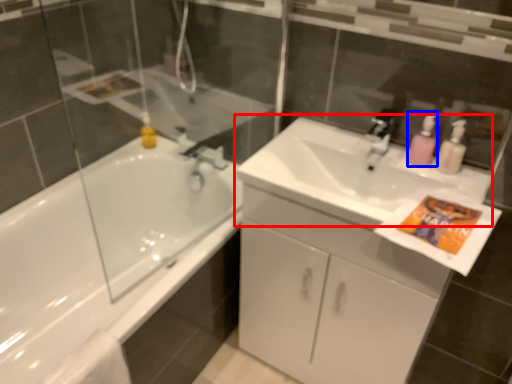
Question: Which point is closer to the camera, sink (highlighted by a red box) or soap dispenser (highlighted by a blue box)?

Choices:
 (A) sink
 (B) soap dispenser

Answer: (A)